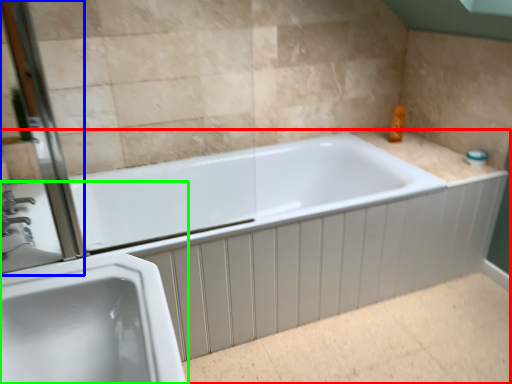
Question: Which object is the closest to the bathtub (highlighted by a red box)? Choose among these: screen door (highlighted by a blue box) or sink (highlighted by a green box).

Choices:
 (A) screen door
 (B) sink

Answer: (B)